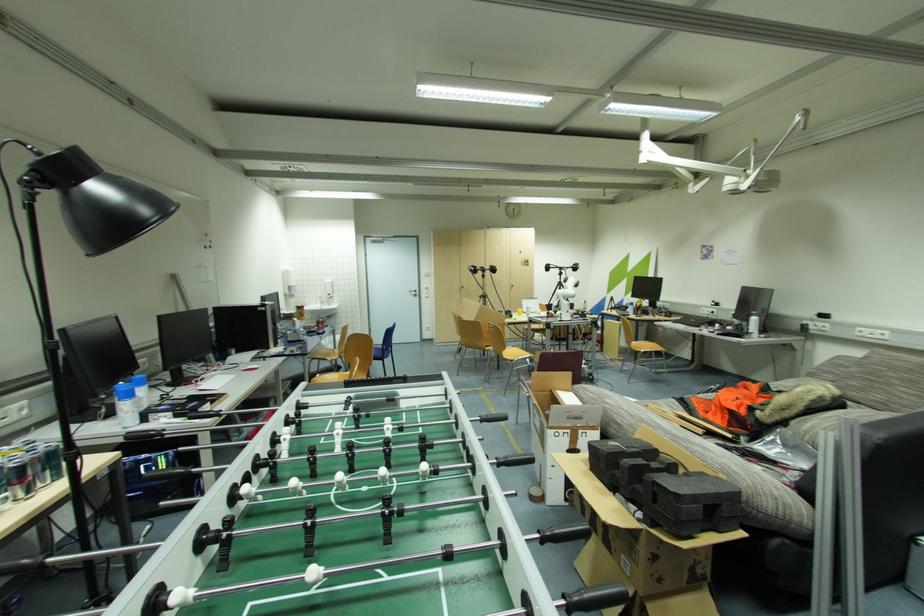
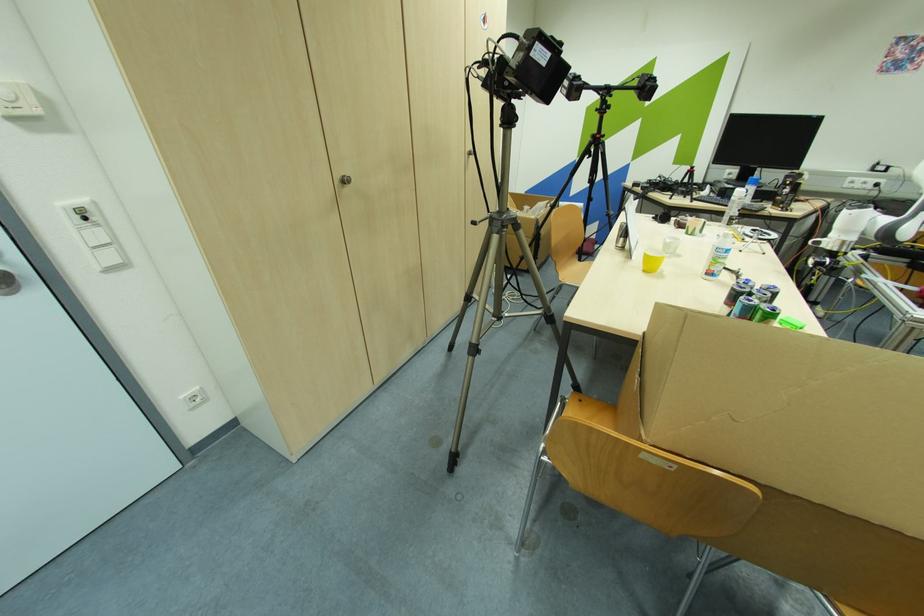
In the second image, find the point that corresponds to (466,288) in the first image.

(348, 182)